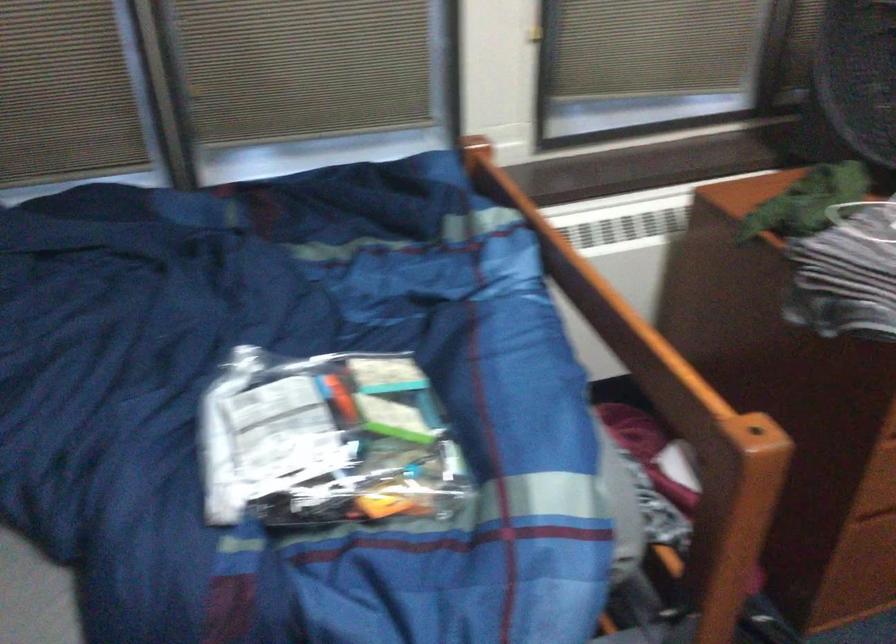
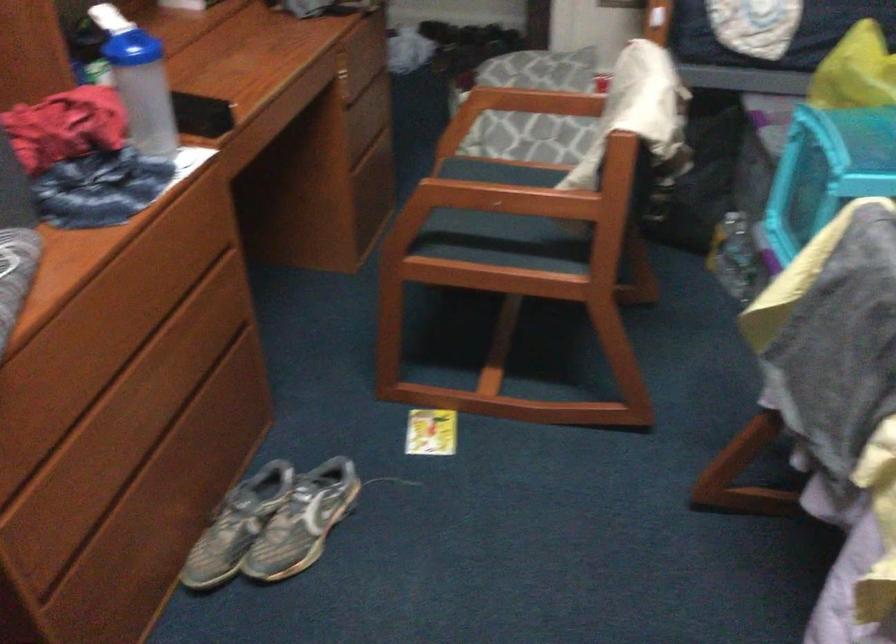
First-person continuous shooting, in which direction is the camera rotating?

The camera rotated toward right-down.